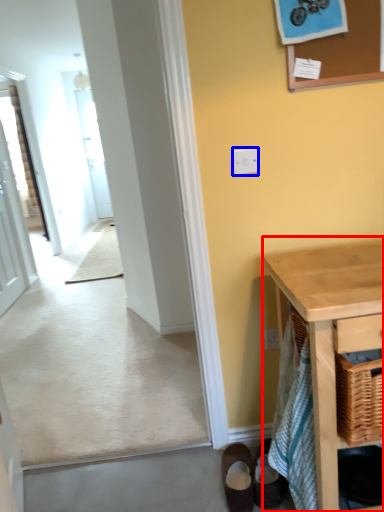
Question: Which of the following is the closest to the observer, table (highlighted by a red box) or light switch (highlighted by a blue box)?

Choices:
 (A) table
 (B) light switch

Answer: (A)